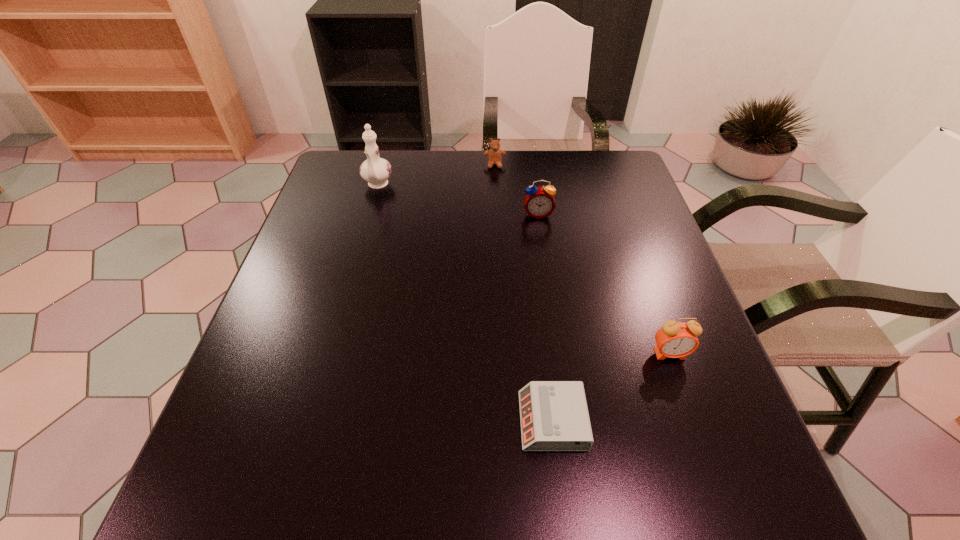
I want to click on unoccupied area between the third farthest object and the shortest alarm clock, so point(545,317).

The width and height of the screenshot is (960, 540). I want to click on empty space that is in between the second shortest object and the rightmost object, so click(x=582, y=259).

You are a GUI agent. You are given a task and a screenshot of the screen. Output one action in this format:
    pyautogui.click(x=<x>, y=<y>)
    Task: Click on the blank region between the farthest object and the rightmost alarm clock
    
    Given the screenshot: What is the action you would take?
    pyautogui.click(x=582, y=259)

This screenshot has width=960, height=540. I want to click on free space between the chinaware and the second farthest alarm clock, so click(523, 269).

This screenshot has width=960, height=540. What are the coordinates of `blank region between the farthest alarm clock and the chinaware` in the screenshot? It's located at 458,200.

Locate an element on the screen. The width and height of the screenshot is (960, 540). object that ranks as the closest to the teddy bear is located at coordinates (539, 202).

Choose which object is the nearest neighbor to the farthest object. Please provide its 2D coordinates. Your answer should be formatted as a tuple, i.e. [(x, y)], where the tuple contains the x and y coordinates of a point satisfying the conditions above.

[(539, 202)]

This screenshot has height=540, width=960. I want to click on alarm clock that stands as the third closest to the farthest object, so click(x=554, y=416).

Where is `the second closest alarm clock to the shortest object`? the second closest alarm clock to the shortest object is located at coordinates (539, 202).

The width and height of the screenshot is (960, 540). I want to click on free space that satisfies the following two spatial constraints: 1. at the spout of the second farthest object; 2. on the left side of the shortest alarm clock, so click(x=312, y=421).